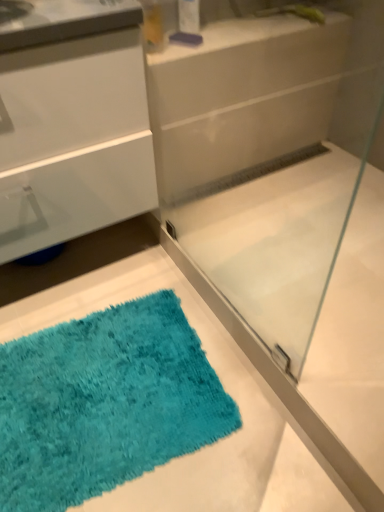
Question: Can you confirm if transparent glass shower door at center is thinner than turquoise shaggy bath mat at lower left?

Choices:
 (A) no
 (B) yes

Answer: (B)

Question: From the image's perspective, is transparent glass shower door at center on turquoise shaggy bath mat at lower left?

Choices:
 (A) yes
 (B) no

Answer: (A)

Question: From a real-world perspective, is transparent glass shower door at center under turquoise shaggy bath mat at lower left?

Choices:
 (A) no
 (B) yes

Answer: (A)

Question: Is there a large distance between transparent glass shower door at center and turquoise shaggy bath mat at lower left?

Choices:
 (A) yes
 (B) no

Answer: (B)

Question: Is turquoise shaggy bath mat at lower left located within transparent glass shower door at center?

Choices:
 (A) yes
 (B) no

Answer: (B)

Question: Considering the relative positions of transparent glass shower door at center and turquoise shaggy bath mat at lower left in the image provided, is transparent glass shower door at center to the right of turquoise shaggy bath mat at lower left from the viewer's perspective?

Choices:
 (A) yes
 (B) no

Answer: (A)

Question: Considering the relative positions of turquoise shaggy bath mat at lower left and white glossy counter at upper center in the image provided, is turquoise shaggy bath mat at lower left to the right of white glossy counter at upper center from the viewer's perspective?

Choices:
 (A) yes
 (B) no

Answer: (B)

Question: Is turquoise shaggy bath mat at lower left positioned in front of white glossy counter at upper center?

Choices:
 (A) yes
 (B) no

Answer: (A)

Question: Considering the relative sizes of turquoise shaggy bath mat at lower left and white glossy counter at upper center in the image provided, is turquoise shaggy bath mat at lower left smaller than white glossy counter at upper center?

Choices:
 (A) yes
 (B) no

Answer: (B)

Question: From the image's perspective, is turquoise shaggy bath mat at lower left under white glossy counter at upper center?

Choices:
 (A) no
 (B) yes

Answer: (B)

Question: From the image's perspective, is turquoise shaggy bath mat at lower left over white glossy counter at upper center?

Choices:
 (A) no
 (B) yes

Answer: (A)

Question: Can you confirm if turquoise shaggy bath mat at lower left is thinner than white glossy counter at upper center?

Choices:
 (A) yes
 (B) no

Answer: (B)

Question: Considering the relative sizes of turquoise shaggy bath mat at lower left and transparent glass shower door at center in the image provided, is turquoise shaggy bath mat at lower left shorter than transparent glass shower door at center?

Choices:
 (A) yes
 (B) no

Answer: (A)